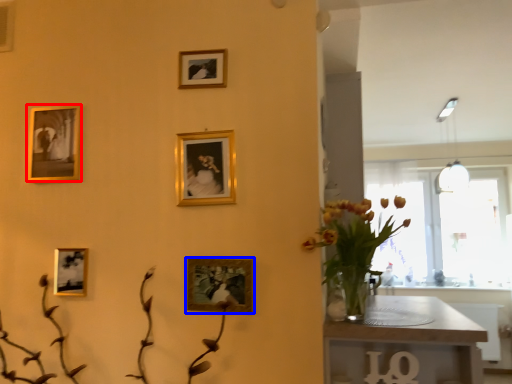
Question: Which of the following is the farthest to the observer, picture frame (highlighted by a red box) or picture frame (highlighted by a blue box)?

Choices:
 (A) picture frame
 (B) picture frame

Answer: (A)